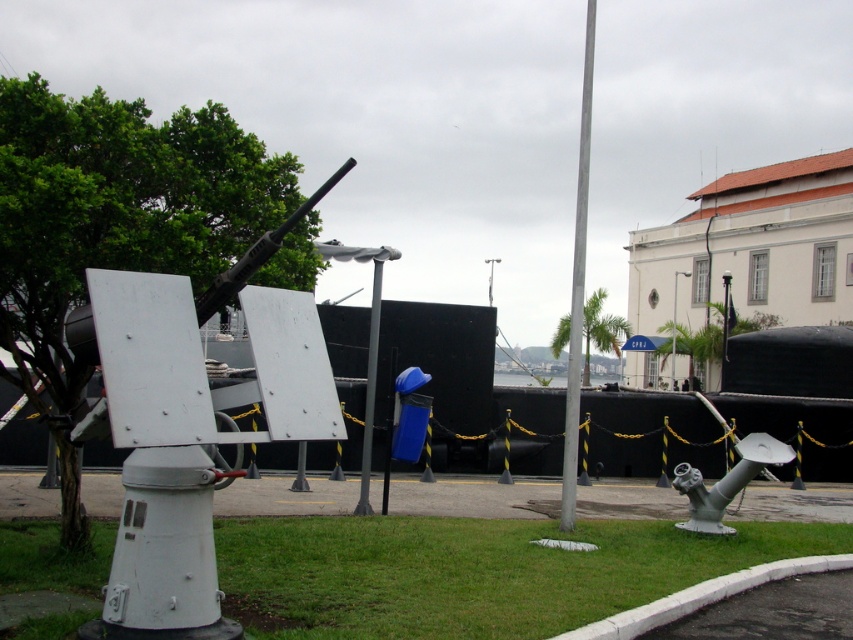
You are a museum security guard checking the exhibit. You need to ensure that the white matte cannon at center and the metallic pole at center are within the restricted area marked by the yellow and black caution tape. Based on their sizes, which object is more likely to extend beyond the caution tape?

The white matte cannon at center is bigger than the metallic pole at center, so it is more likely to extend beyond the caution tape.

You are standing at the center of the exhibit. Where is the silver metallic cannon at lower right located relative to your position?

The silver metallic cannon at lower right is located at point [726,481] relative to your position.

You are a visitor at the naval exhibit and want to take a photo of both the white matte cannon at center and the silver metallic pole at center. Which object should you position closer to the left side of your camera frame to include both in the shot?

To include both the white matte cannon at center and the silver metallic pole at center in your photo, position the white matte cannon at center closer to the left side of your camera frame since it is already located to the left of the silver metallic pole at center.